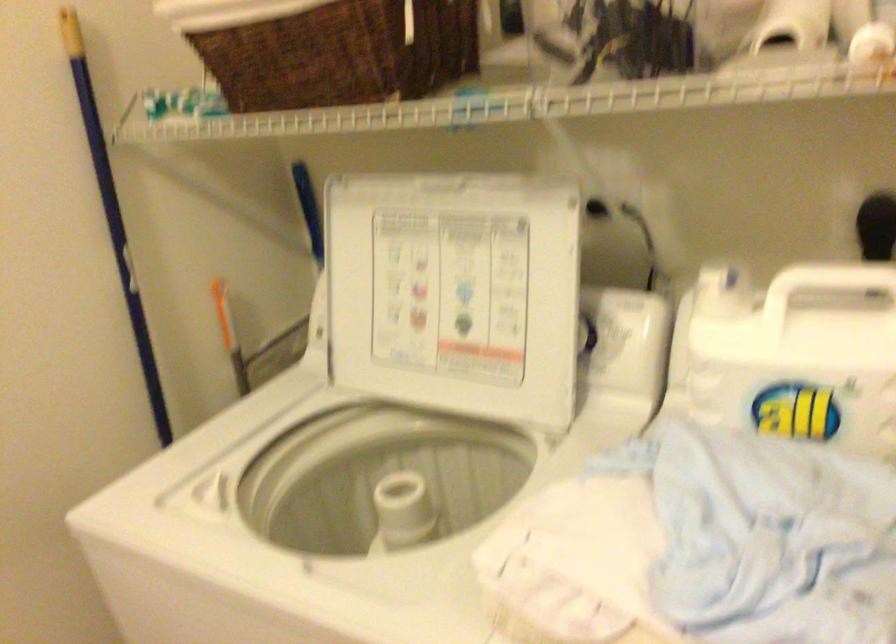
Describe the element at coordinates (616, 325) in the screenshot. This screenshot has height=644, width=896. I see `the white machine dial` at that location.